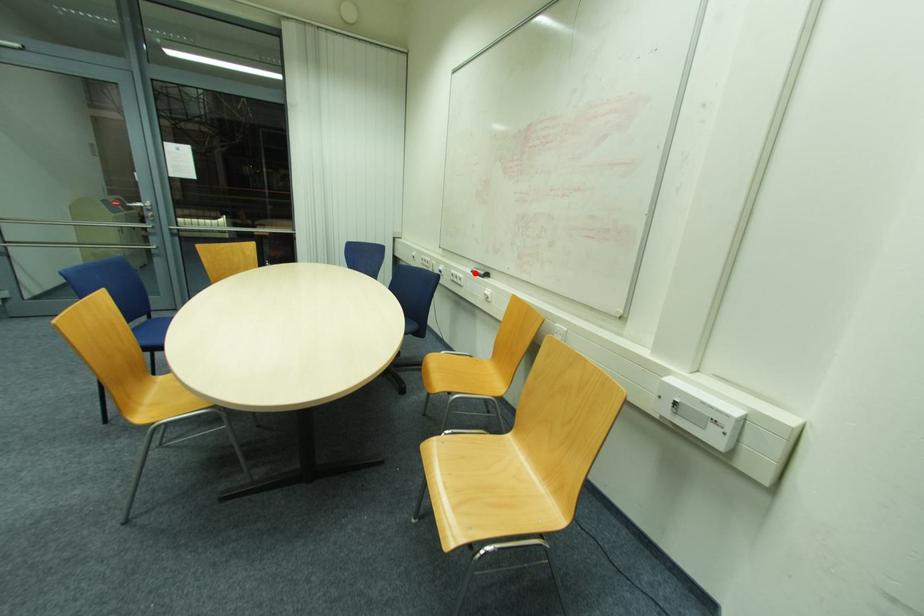
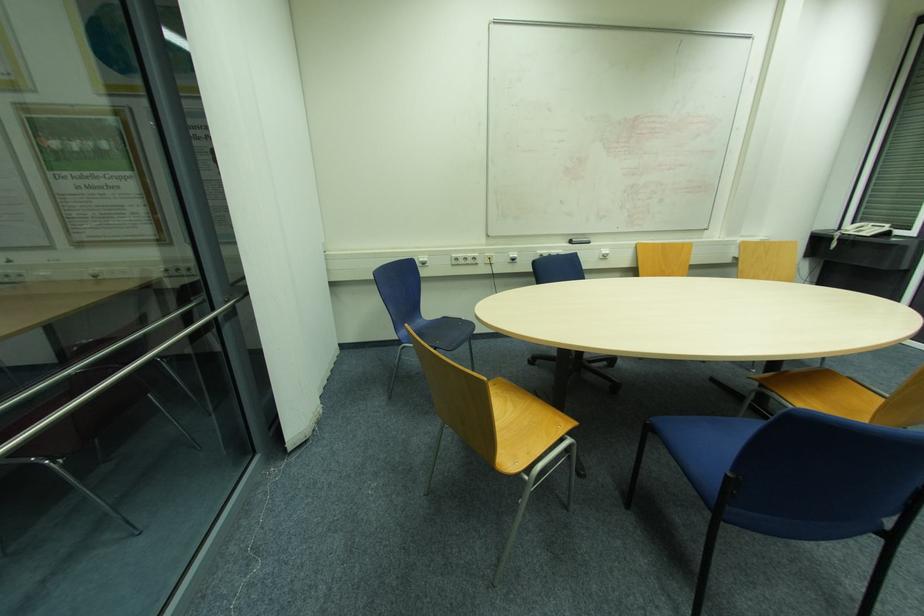
Locate, in the second image, the point that corresponds to the highlighted location in the first image.

(574, 244)